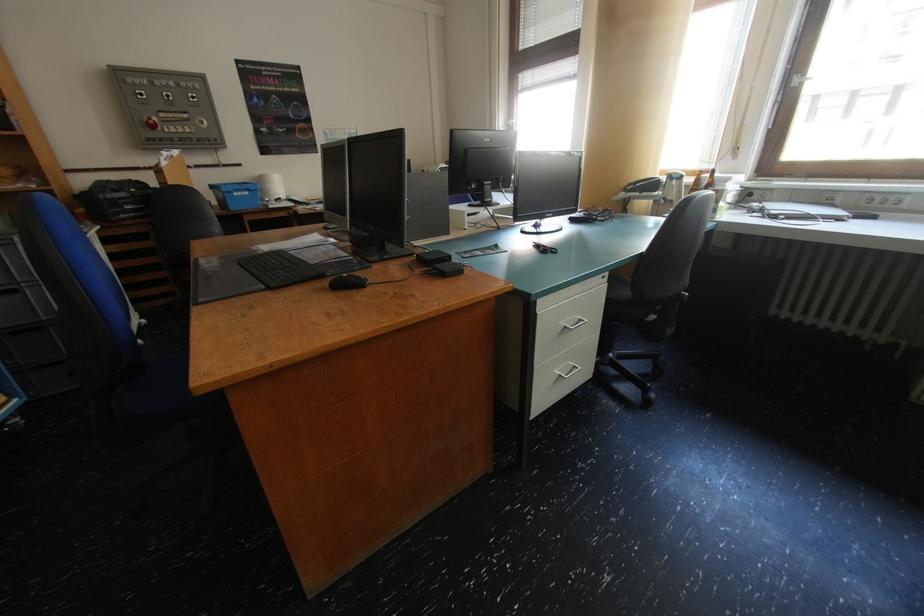
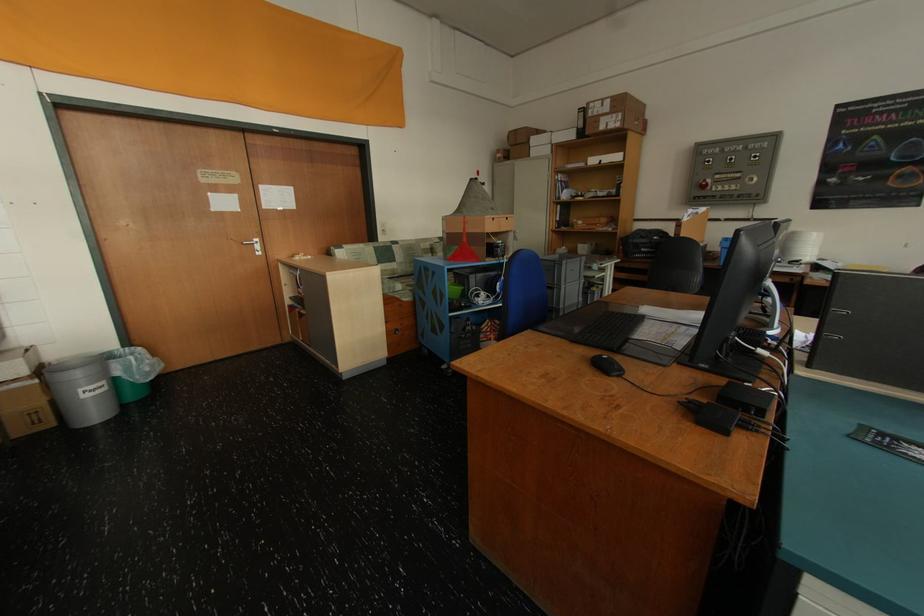
Find the pixel in the second image that matches (317,212) in the first image.

(832, 283)